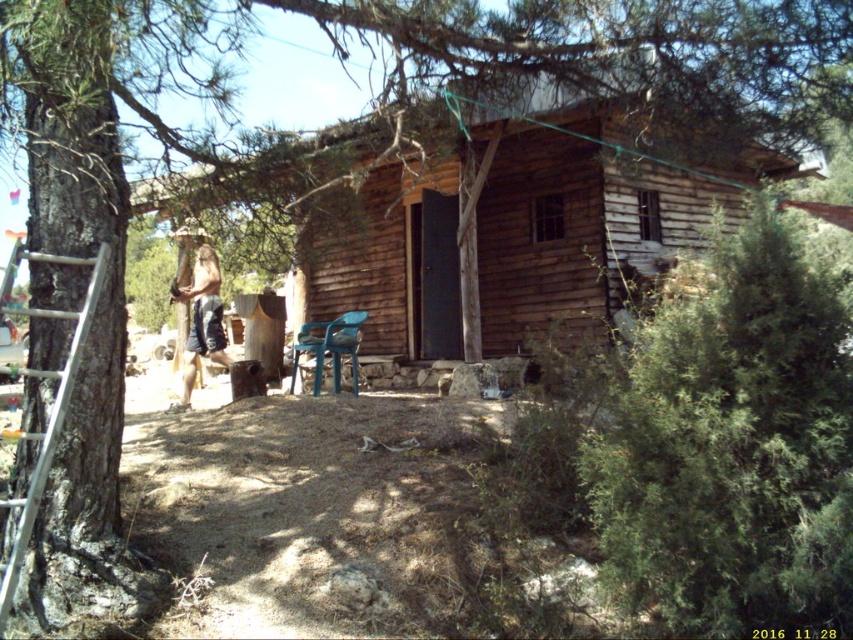
Question: Is the position of wooden log cabin at center more distant than that of beige fabric shorts at center?

Choices:
 (A) yes
 (B) no

Answer: (B)

Question: Which point is farther to the camera?

Choices:
 (A) beige fabric shorts at center
 (B) silver metallic ladder at left
 (C) blue plastic chair at center
 (D) wooden log cabin at center

Answer: (C)

Question: Which point is farther from the camera taking this photo?

Choices:
 (A) (299, 332)
 (B) (196, 321)
 (C) (527, 147)
 (D) (18, 518)

Answer: (A)

Question: Which object is positioned closest to the beige fabric shorts at center?

Choices:
 (A) wooden log cabin at center
 (B) silver metallic ladder at left

Answer: (A)

Question: Can you confirm if silver metallic ladder at left is positioned below beige fabric shorts at center?

Choices:
 (A) no
 (B) yes

Answer: (B)

Question: Does wooden log cabin at center appear under silver metallic ladder at left?

Choices:
 (A) yes
 (B) no

Answer: (B)